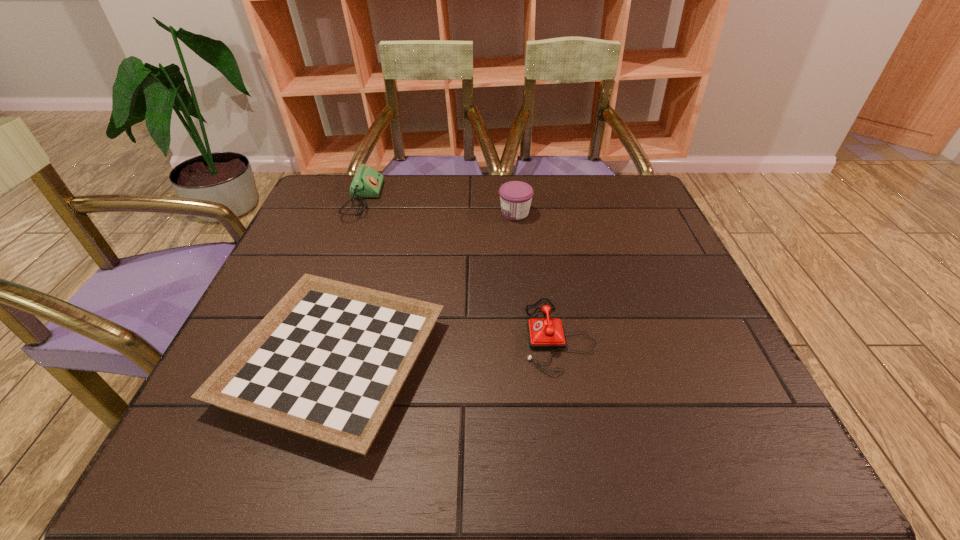
This screenshot has height=540, width=960. Identify the location of jam. (515, 196).

Identify the location of the farther telephone. This screenshot has width=960, height=540. (367, 182).

You are a GUI agent. You are given a task and a screenshot of the screen. Output one action in this format:
    pyautogui.click(x=<x>, y=<y>)
    Task: Click on the nearer telephone
    
    Given the screenshot: What is the action you would take?
    pyautogui.click(x=544, y=333)

Where is `the right telephone`? The width and height of the screenshot is (960, 540). the right telephone is located at coordinates (544, 333).

Find the location of a particular element. the shortest object is located at coordinates (328, 361).

The image size is (960, 540). What are the coordinates of `free space located on the front label of the jam` in the screenshot? It's located at (406, 213).

Identify the location of vacant region located 0.340m on the front label of the jam. The height and width of the screenshot is (540, 960). (373, 213).

Identify the location of vacant space situated on the front label of the jam. (396, 213).

Find the location of a particular element. The image size is (960, 540). free space located on the dial of the left telephone is located at coordinates (499, 200).

The height and width of the screenshot is (540, 960). I want to click on vacant area situated 0.050m on the dial of the nearer telephone, so click(x=499, y=335).